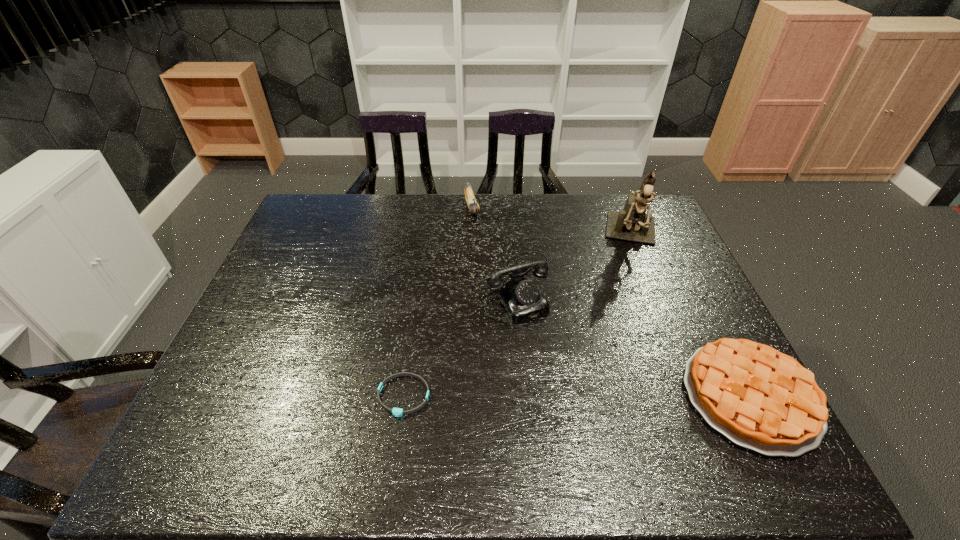
The width and height of the screenshot is (960, 540). What are the coordinates of `free space between the telephone and the fourth tallest object` in the screenshot? It's located at coord(631,341).

Locate an element on the screen. The image size is (960, 540). free space between the telephone and the wristband is located at coordinates (458, 340).

I want to click on free spot between the banana and the shortest object, so click(x=438, y=302).

Identify the location of empty location between the pie and the banana. Image resolution: width=960 pixels, height=540 pixels. (612, 302).

The width and height of the screenshot is (960, 540). In order to click on free space between the wristband and the telephone in this screenshot , I will do tap(458, 340).

Image resolution: width=960 pixels, height=540 pixels. Find the location of `free area in between the fourth tallest object and the banana`. free area in between the fourth tallest object and the banana is located at coordinates (612, 302).

This screenshot has width=960, height=540. I want to click on free spot between the shortest object and the banana, so click(438, 302).

At what (x,y) coordinates should I click in order to perform the action: click on unoccupied position between the banana and the telephone. Please return your answer as a coordinate pair (x, y). Looking at the image, I should click on (492, 246).

The height and width of the screenshot is (540, 960). I want to click on vacant area that lies between the banana and the wristband, so click(438, 302).

You are a GUI agent. You are given a task and a screenshot of the screen. Output one action in this format:
    pyautogui.click(x=<x>, y=<y>)
    Task: Click on the second closest object to the figurine
    
    Given the screenshot: What is the action you would take?
    pyautogui.click(x=759, y=398)